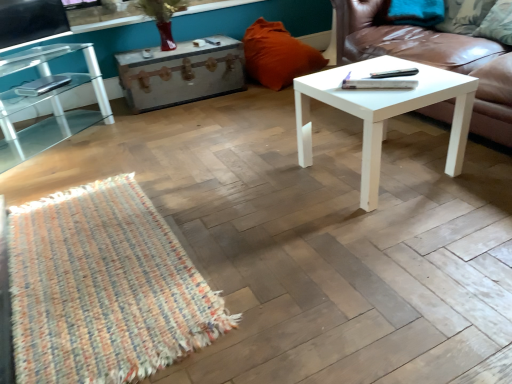
You are a GUI agent. You are given a task and a screenshot of the screen. Output one action in this format:
    pyautogui.click(x=<x>, y=<y>)
    Task: Click on the white leather couch at right
    
    Given the screenshot: What is the action you would take?
    pyautogui.click(x=432, y=59)

Measure the distance between point (469, 48) and camera.

Point (469, 48) is 2.27 meters from camera.

Consider the image. What is the approximate width of white matte coffee table at center?

The width of white matte coffee table at center is 22.98 inches.

Describe the element at coordinates (384, 112) in the screenshot. Image resolution: width=512 pixels, height=384 pixels. I see `white matte coffee table at center` at that location.

Image resolution: width=512 pixels, height=384 pixels. What do you see at coordinates (497, 23) in the screenshot?
I see `green fabric pillow at upper right, acting as the first pillow starting from the front` at bounding box center [497, 23].

What is the approximate width of green fabric pillow at upper right, placed as the first pillow when sorted from right to left?

green fabric pillow at upper right, placed as the first pillow when sorted from right to left, is 9.10 inches in width.

This screenshot has height=384, width=512. Identify the location of rustic wood trunk at center. (181, 77).

Identify the location of clear glass table at left. (47, 99).

Identify the location of white leather couch at right. This screenshot has width=512, height=384. (432, 59).

Which pillow is the 2nd one when counting from the right side of the clear glass table at left? Please provide its 2D coordinates.

[(497, 23)]

From a real-world perspective, is green fabric pillow at upper right, acting as the first pillow starting from the front, positioned over clear glass table at left based on gravity?

Yes, from a real-world perspective, green fabric pillow at upper right, acting as the first pillow starting from the front, is above clear glass table at left.

Which is in front, point (499, 22) or point (25, 142)?

The point (499, 22) is closer.

Can you confirm if green fabric pillow at upper right, which appears as the 2th pillow when viewed from the left, is thinner than clear glass table at left?

Yes, green fabric pillow at upper right, which appears as the 2th pillow when viewed from the left, is thinner than clear glass table at left.

Which of these two, white leather couch at right or white matte coffee table at center, stands taller?

Standing taller between the two is white leather couch at right.

Which of these two, white leather couch at right or white matte coffee table at center, is thinner?

white matte coffee table at center.

Is white leather couch at right not close to white matte coffee table at center?

white leather couch at right is near white matte coffee table at center, not far away.

Looking at this image, from a real-world perspective, who is located lower, white leather couch at right or white matte coffee table at center?

white matte coffee table at center.

Which object is more forward, rustic wood trunk at center or green fabric pillow at upper right, acting as the first pillow starting from the front?

green fabric pillow at upper right, acting as the first pillow starting from the front, is in front.

Find the location of a particular element. drawer on the left of the green fabric pillow at upper right, acting as the first pillow starting from the front is located at coordinates [x=181, y=77].

Would you say rustic wood trunk at center is a long distance from green fabric pillow at upper right, which appears as the 2th pillow when viewed from the left?

Indeed, rustic wood trunk at center is not near green fabric pillow at upper right, which appears as the 2th pillow when viewed from the left.

How distant is rustic wood trunk at center from green fabric pillow at upper right, which appears as the 2th pillow when viewed from the left?

rustic wood trunk at center is 6.21 feet away from green fabric pillow at upper right, which appears as the 2th pillow when viewed from the left.

Would you say rustic wood trunk at center is to the left or to the right of white leather couch at right in the picture?

Based on their positions, rustic wood trunk at center is located to the left of white leather couch at right.

Considering the sizes of rustic wood trunk at center and white leather couch at right in the image, is rustic wood trunk at center taller or shorter than white leather couch at right?

In the image, rustic wood trunk at center appears to be shorter than white leather couch at right.

Would you say rustic wood trunk at center is inside or outside white leather couch at right?

rustic wood trunk at center cannot be found inside white leather couch at right.

From a real-world perspective, is rustic wood trunk at center beneath white leather couch at right?

Yes, from a real-world perspective, rustic wood trunk at center is under white leather couch at right.

How many degrees apart are the facing directions of clear glass table at left and orange fabric pillow at upper center, the first pillow when ordered from left to right?

The angular difference between clear glass table at left and orange fabric pillow at upper center, the first pillow when ordered from left to right, is 41 degrees.

Is clear glass table at left to the left or to the right of orange fabric pillow at upper center, the first pillow when ordered from left to right, in the image?

clear glass table at left is positioned on orange fabric pillow at upper center, the first pillow when ordered from left to right,'s left side.

From the image's perspective, is clear glass table at left located beneath orange fabric pillow at upper center, which appears as the 2th pillow when viewed from the front?

Indeed, from the image's perspective, clear glass table at left is shown beneath orange fabric pillow at upper center, which appears as the 2th pillow when viewed from the front.

Does white matte coffee table at center turn towards green fabric pillow at upper right, which is counted as the second pillow, starting from the back?

No, white matte coffee table at center is not turned towards green fabric pillow at upper right, which is counted as the second pillow, starting from the back.

From the image's perspective, would you say white matte coffee table at center is positioned over green fabric pillow at upper right, acting as the first pillow starting from the front?

No, from the image's perspective, white matte coffee table at center is not on top of green fabric pillow at upper right, acting as the first pillow starting from the front.

Consider the image. Between white matte coffee table at center and green fabric pillow at upper right, which appears as the 2th pillow when viewed from the left, which one has less height?

green fabric pillow at upper right, which appears as the 2th pillow when viewed from the left.

Is white matte coffee table at center smaller than green fabric pillow at upper right, acting as the first pillow starting from the front?

Actually, white matte coffee table at center might be larger than green fabric pillow at upper right, acting as the first pillow starting from the front.

From a real-world perspective, who is located higher, white matte coffee table at center or white leather couch at right?

white leather couch at right.

This screenshot has width=512, height=384. I want to click on coffee table located below the white leather couch at right (from the image's perspective), so click(384, 112).

Does white matte coffee table at center contain white leather couch at right?

No, white leather couch at right is not surrounded by white matte coffee table at center.

Find the location of a particular element. table that appears on the left of green fabric pillow at upper right, placed as the first pillow when sorted from right to left is located at coordinates (47, 99).

Where is `coffee table below the white leather couch at right (from the image's perspective)`? coffee table below the white leather couch at right (from the image's perspective) is located at coordinates (384, 112).

Based on their spatial positions, is clear glass table at left or white leather couch at right closer to rustic wood trunk at center?

clear glass table at left is positioned closer to the anchor rustic wood trunk at center.

Based on their spatial positions, is rustic wood trunk at center or orange fabric pillow at upper center, acting as the 1th pillow starting from the back, closer to white matte coffee table at center?

orange fabric pillow at upper center, acting as the 1th pillow starting from the back, lies closer to white matte coffee table at center than the other object.

Which object lies further to the anchor point rustic wood trunk at center, white leather couch at right or orange fabric pillow at upper center, which ranks as the 2th pillow in right-to-left order?

Among the two, white leather couch at right is located further to rustic wood trunk at center.

Based on their spatial positions, is green fabric pillow at upper right, placed as the first pillow when sorted from right to left, or white leather couch at right closer to orange fabric pillow at upper center, acting as the 1th pillow starting from the back?

white leather couch at right is closer to orange fabric pillow at upper center, acting as the 1th pillow starting from the back.

Estimate the real-world distances between objects in this image. Which object is closer to orange fabric pillow at upper center, acting as the 1th pillow starting from the back, white matte coffee table at center or green fabric pillow at upper right, which appears as the 2th pillow when viewed from the left?

green fabric pillow at upper right, which appears as the 2th pillow when viewed from the left, is closer to orange fabric pillow at upper center, acting as the 1th pillow starting from the back.

Looking at the image, which one is located further to orange fabric pillow at upper center, acting as the 1th pillow starting from the back, clear glass table at left or green fabric pillow at upper right, which appears as the 2th pillow when viewed from the left?

Among the two, clear glass table at left is located further to orange fabric pillow at upper center, acting as the 1th pillow starting from the back.

Based on their spatial positions, is white matte coffee table at center or white leather couch at right further from rustic wood trunk at center?

white matte coffee table at center is positioned further to the anchor rustic wood trunk at center.

When comparing their distances from white matte coffee table at center, does green fabric pillow at upper right, placed as the first pillow when sorted from right to left, or rustic wood trunk at center seem further?

rustic wood trunk at center is positioned further to the anchor white matte coffee table at center.

Locate an element on the screen. This screenshot has height=384, width=512. drawer between clear glass table at left and white matte coffee table at center is located at coordinates (181, 77).

Image resolution: width=512 pixels, height=384 pixels. I want to click on drawer between clear glass table at left and green fabric pillow at upper right, which appears as the 2th pillow when viewed from the left, from left to right, so click(x=181, y=77).

The image size is (512, 384). Find the location of `pillow located between white leather couch at right and orange fabric pillow at upper center, which appears as the 2th pillow when viewed from the front, in the depth direction`. pillow located between white leather couch at right and orange fabric pillow at upper center, which appears as the 2th pillow when viewed from the front, in the depth direction is located at coordinates (497, 23).

Find the location of a particular element. This screenshot has height=384, width=512. studio couch between white matte coffee table at center and orange fabric pillow at upper center, the first pillow when ordered from left to right, along the z-axis is located at coordinates (432, 59).